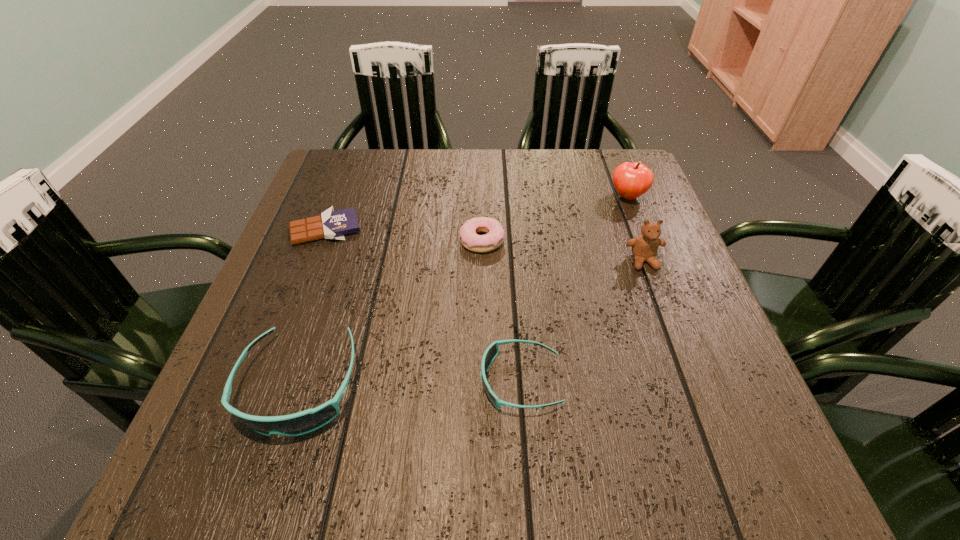
At what (x,y) coordinates should I click in order to perform the action: click on blank area located on the front-facing side of the right sunglasses. Please return your answer as a coordinate pair (x, y). This screenshot has width=960, height=540. Looking at the image, I should click on (291, 381).

The width and height of the screenshot is (960, 540). In order to click on free location located on the front of the farthest object in this screenshot , I will do `click(638, 223)`.

You are a GUI agent. You are given a task and a screenshot of the screen. Output one action in this format:
    pyautogui.click(x=<x>, y=<y>)
    Task: Click on the free space located 0.290m on the right of the doughnut
    
    Given the screenshot: What is the action you would take?
    pyautogui.click(x=629, y=240)

This screenshot has height=540, width=960. Identify the location of free space located on the right of the shortest object. (492, 229).

Identify the location of free space located on the face of the teddy bear. The image size is (960, 540). (692, 393).

Image resolution: width=960 pixels, height=540 pixels. I want to click on object situated at the far edge, so click(x=631, y=180).

Where is `sunglasses that is at the left edge`? The width and height of the screenshot is (960, 540). sunglasses that is at the left edge is located at coordinates (303, 422).

The image size is (960, 540). Identify the location of chocolate bar at the left edge. (331, 224).

This screenshot has width=960, height=540. I want to click on apple that is at the right edge, so click(631, 180).

The height and width of the screenshot is (540, 960). In order to click on teddy bear present at the right edge in this screenshot , I will do `click(644, 247)`.